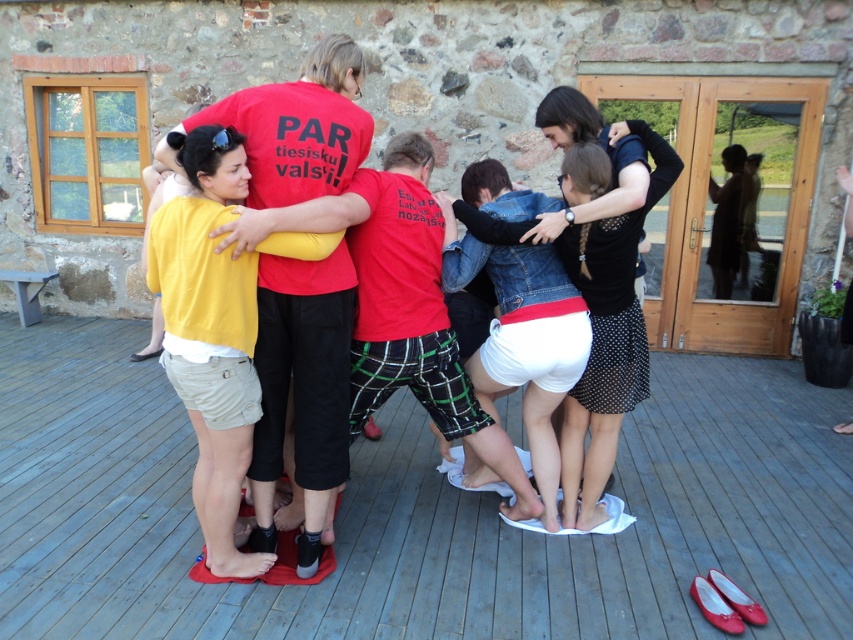
Question: Is wooden deck at center thinner than yellow cotton shirt at left?

Choices:
 (A) no
 (B) yes

Answer: (A)

Question: Can you confirm if wooden deck at center is positioned to the right of yellow cotton shirt at left?

Choices:
 (A) yes
 (B) no

Answer: (A)

Question: Which of the following is the farthest from the observer?

Choices:
 (A) yellow cotton shirt at left
 (B) wooden deck at center

Answer: (B)

Question: Can you confirm if wooden deck at center is wider than yellow cotton shirt at left?

Choices:
 (A) no
 (B) yes

Answer: (B)

Question: Among these points, which one is nearest to the camera?

Choices:
 (A) (210, 525)
 (B) (41, 400)

Answer: (A)